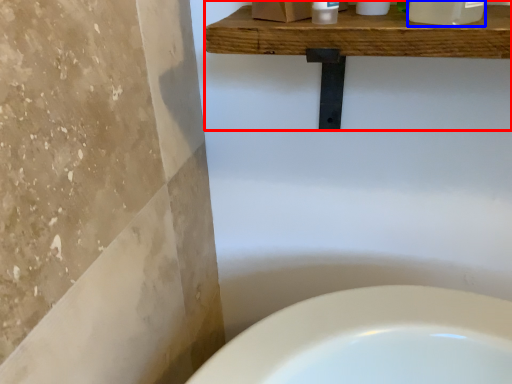
Question: Which of the following is the farthest to the observer, balustrade (highlighted by a red box) or cleaning product (highlighted by a blue box)?

Choices:
 (A) balustrade
 (B) cleaning product

Answer: (A)